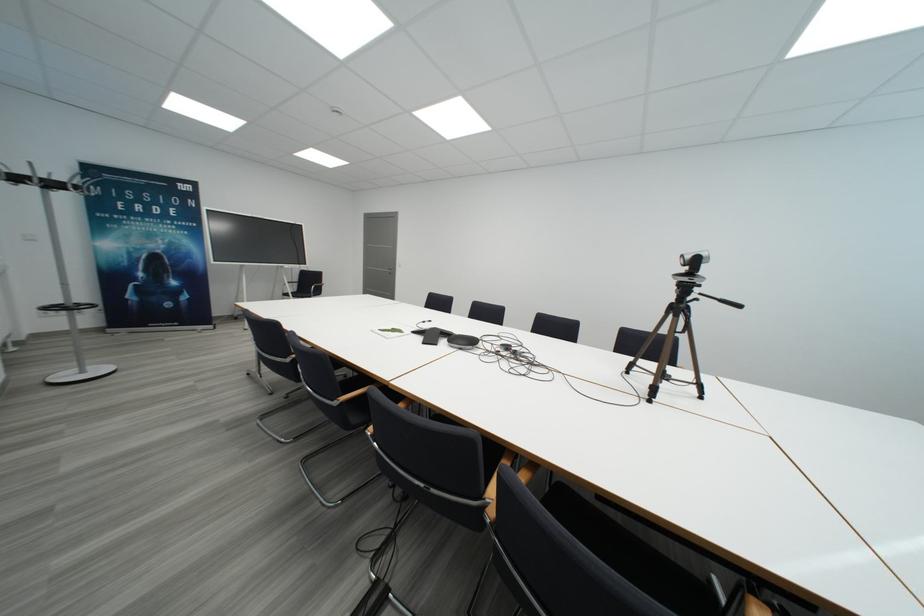
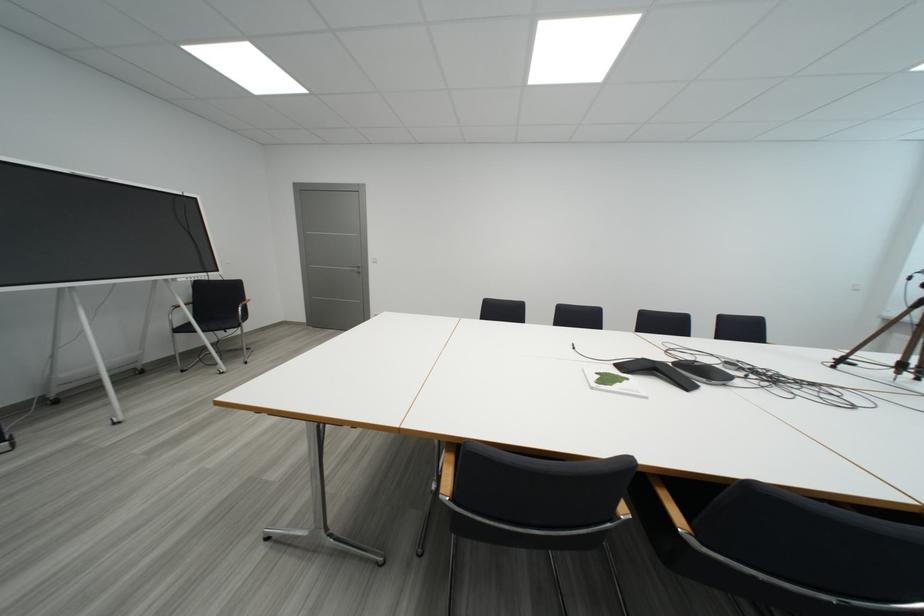
The point at (492, 341) is marked in the first image. Where is the corresponding point in the second image?

(697, 361)